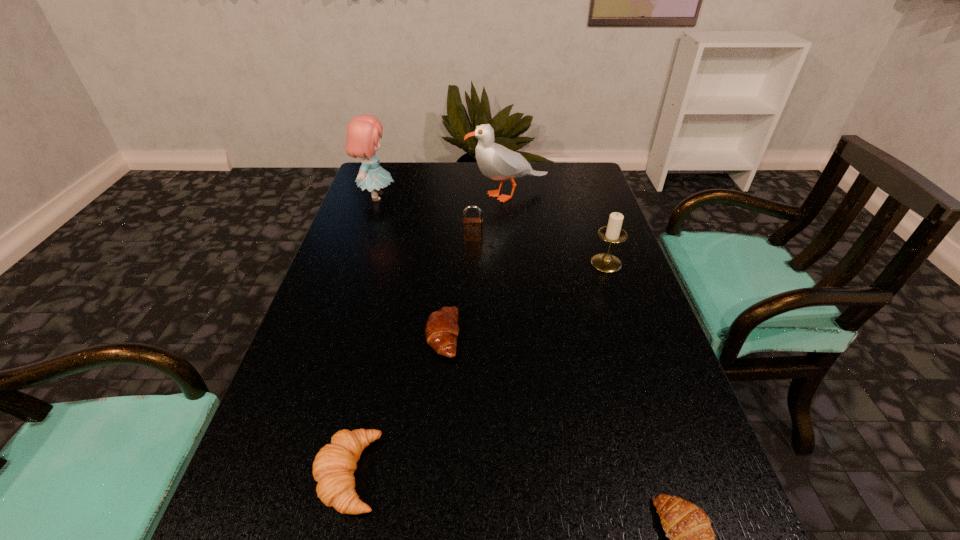
You are a GUI agent. You are given a task and a screenshot of the screen. Output one action in this format:
    pyautogui.click(x=<x>, y=<y>)
    Task: Click on the vacant region that satisfies the following two spatial constraints: 1. on the front-facing side of the doll; 2. on the right side of the leftmost crescent roll
    The height and width of the screenshot is (540, 960).
    Given the screenshot: What is the action you would take?
    pyautogui.click(x=281, y=474)